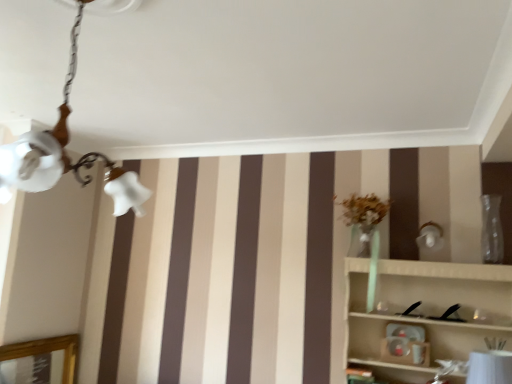
Question: Are white glossy table lamp at lower right and white frosted glass chandelier at upper left far apart?

Choices:
 (A) yes
 (B) no

Answer: (A)

Question: Is white glossy table lamp at lower right shorter than white frosted glass chandelier at upper left?

Choices:
 (A) no
 (B) yes

Answer: (B)

Question: Can you confirm if white glossy table lamp at lower right is positioned to the right of white frosted glass chandelier at upper left?

Choices:
 (A) yes
 (B) no

Answer: (A)

Question: Is white frosted glass chandelier at upper left at the back of white glossy table lamp at lower right?

Choices:
 (A) no
 (B) yes

Answer: (A)

Question: Is white glossy table lamp at lower right outside of white frosted glass chandelier at upper left?

Choices:
 (A) yes
 (B) no

Answer: (A)

Question: From their relative heights in the image, would you say wooden shelf at right is taller or shorter than transparent glass vase at right?

Choices:
 (A) tall
 (B) short

Answer: (A)

Question: Is wooden shelf at right wider or thinner than transparent glass vase at right?

Choices:
 (A) wide
 (B) thin

Answer: (A)

Question: From the image's perspective, is wooden shelf at right positioned above or below transparent glass vase at right?

Choices:
 (A) below
 (B) above

Answer: (A)

Question: In the image, is wooden shelf at right on the left side or the right side of transparent glass vase at right?

Choices:
 (A) left
 (B) right

Answer: (A)

Question: Considering the positions of point (485, 203) and point (472, 365), is point (485, 203) closer or farther from the camera than point (472, 365)?

Choices:
 (A) closer
 (B) farther

Answer: (B)

Question: Is transparent glass vase at right wider or thinner than white glossy table lamp at lower right?

Choices:
 (A) wide
 (B) thin

Answer: (B)

Question: In the image, is transparent glass vase at right positioned in front of or behind white glossy table lamp at lower right?

Choices:
 (A) behind
 (B) front

Answer: (A)

Question: In the image, is transparent glass vase at right on the left side or the right side of white glossy table lamp at lower right?

Choices:
 (A) right
 (B) left

Answer: (A)

Question: In terms of height, does white glossy table lamp at lower right look taller or shorter compared to wooden shelf at right?

Choices:
 (A) tall
 (B) short

Answer: (B)

Question: Is white glossy table lamp at lower right bigger or smaller than wooden shelf at right?

Choices:
 (A) small
 (B) big

Answer: (A)